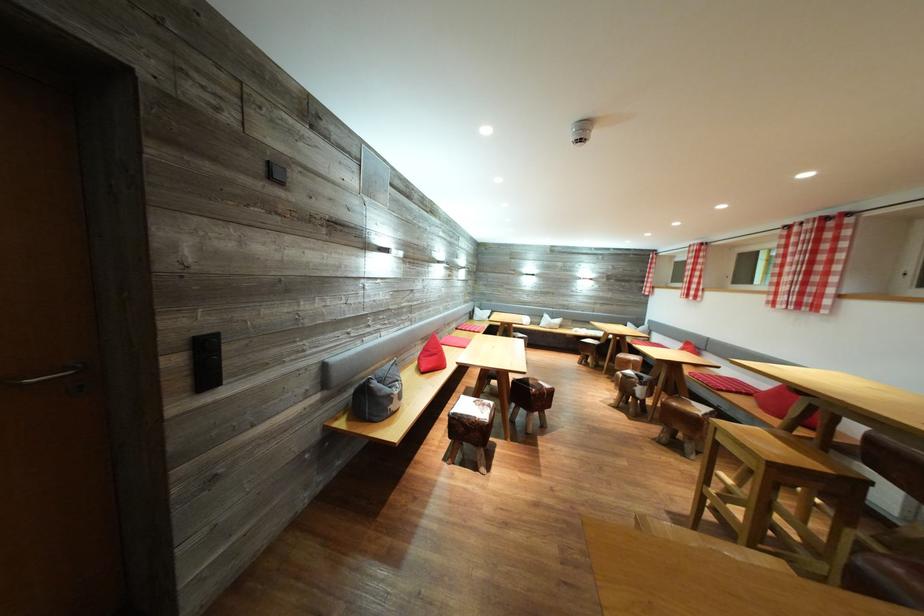
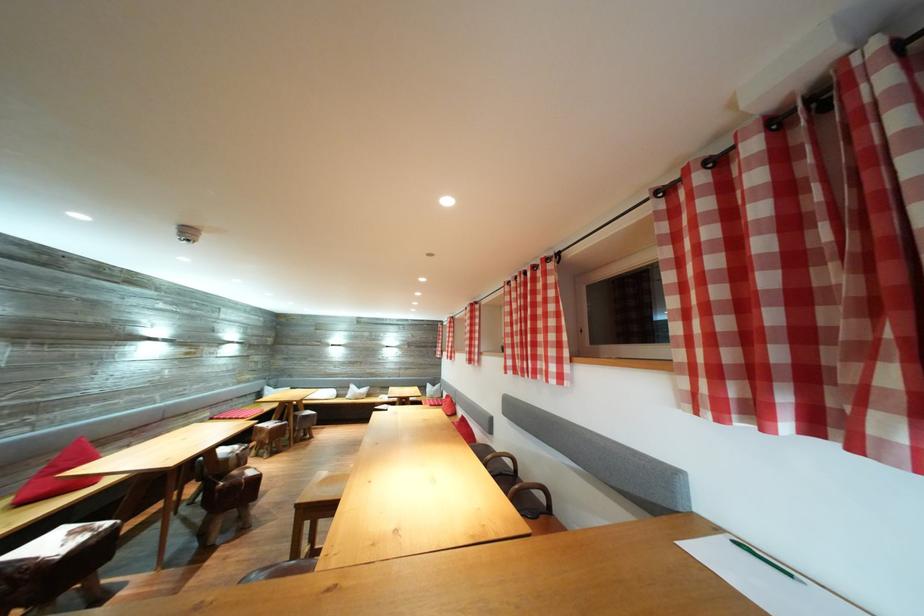
Locate, in the second image, the point that corresponds to [438,371] in the first image.

(51, 496)